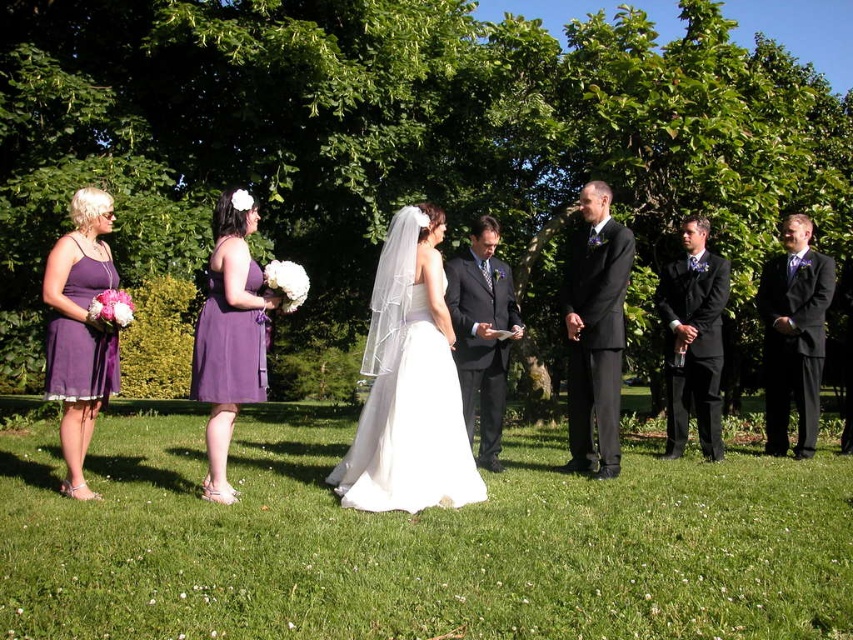
Does purple satin dresses at left appear on the left side of dark suit at center?

Yes, purple satin dresses at left is to the left of dark suit at center.

Who is shorter, purple satin dresses at left or dark suit at center?

Standing shorter between the two is purple satin dresses at left.

In order to click on purple satin dresses at left in this screenshot , I will do `click(410, 381)`.

This screenshot has height=640, width=853. What do you see at coordinates (595, 333) in the screenshot?
I see `black suit at center` at bounding box center [595, 333].

Between point (589, 362) and point (717, 296), which one is positioned in front?

Point (589, 362) is in front.

Who is more forward, (596, 476) or (686, 326)?

Point (596, 476) is in front.

Find the location of a particular element. black suit at center is located at coordinates (595, 333).

Can you confirm if black suit at center is positioned to the left of black suit at right?

Indeed, black suit at center is positioned on the left side of black suit at right.

Is point (582, 456) less distant than point (787, 266)?

Yes, point (582, 456) is closer to viewer.

This screenshot has height=640, width=853. What are the coordinates of `black suit at center` in the screenshot? It's located at (595, 333).